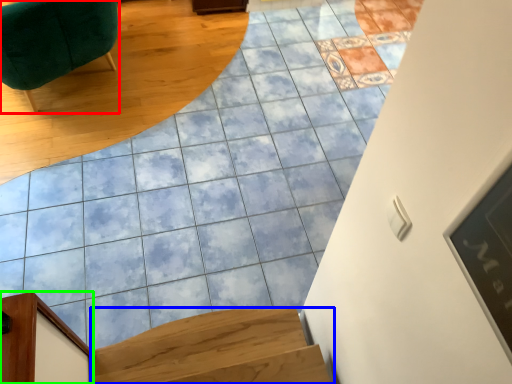
Question: Which is nearer to the furniture (highlighted by a red box)? stairs (highlighted by a blue box) or furniture (highlighted by a green box).

Choices:
 (A) stairs
 (B) furniture

Answer: (B)